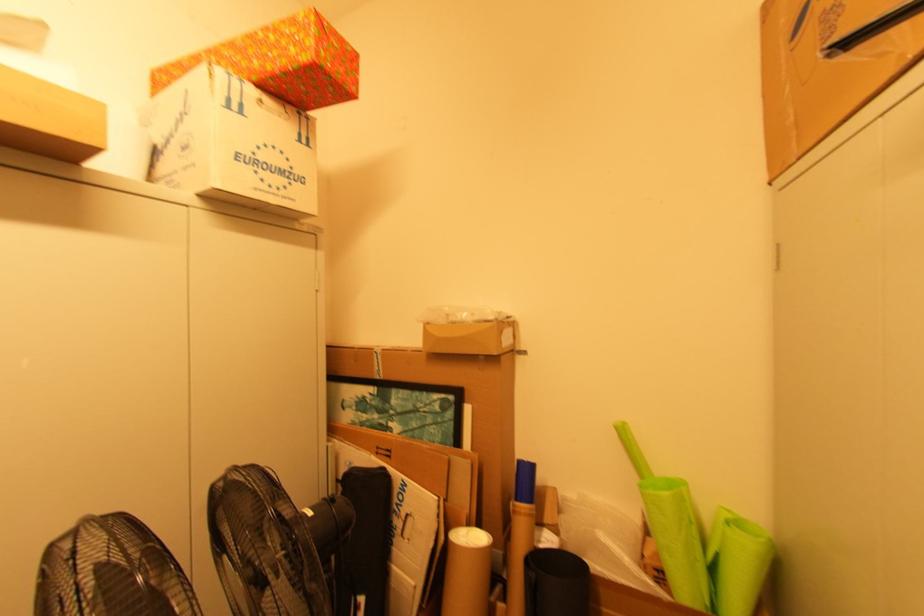
Describe the element at coordinates (232, 143) in the screenshot. I see `the white cardboard box` at that location.